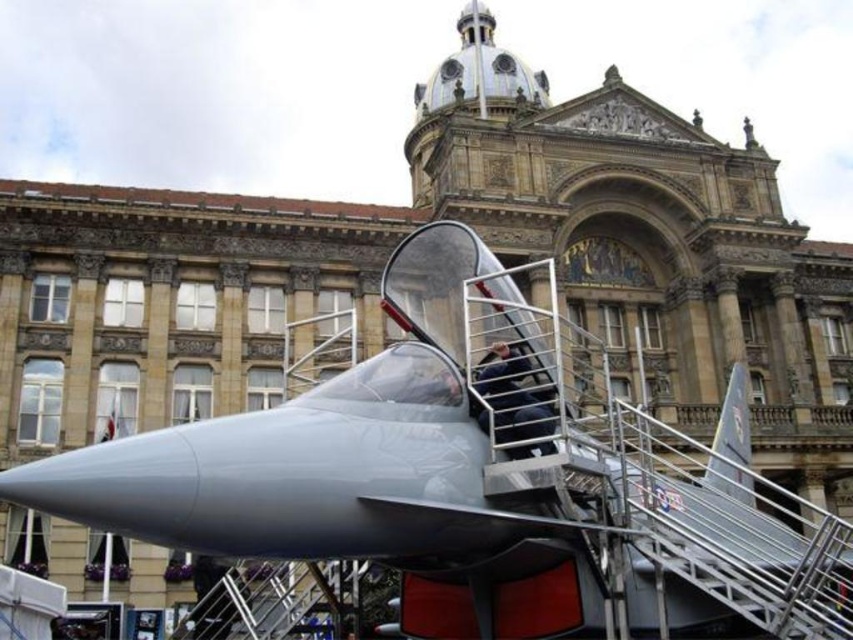
Question: From the image, what is the correct spatial relationship of metallic gray jet at center in relation to stainless steel staircase at center?

Choices:
 (A) right
 (B) left

Answer: (A)

Question: Does metallic gray jet at center have a greater width compared to stainless steel staircase at center?

Choices:
 (A) yes
 (B) no

Answer: (A)

Question: Does metallic gray jet at center have a greater width compared to stainless steel staircase at center?

Choices:
 (A) yes
 (B) no

Answer: (A)